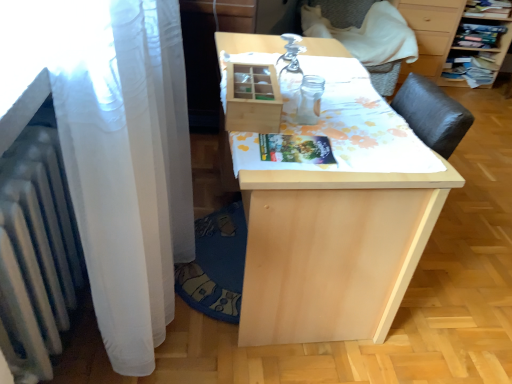
Question: Does point (401, 4) appear closer or farther from the camera than point (369, 238)?

Choices:
 (A) farther
 (B) closer

Answer: (A)

Question: From a real-world perspective, relative to natural wood table at center, is wooden drawer at upper right vertically above or below?

Choices:
 (A) below
 (B) above

Answer: (B)

Question: Estimate the real-world distances between objects in this image. Which object is farther from the natural wood table at center?

Choices:
 (A) gray fabric armchair at upper right
 (B) wooden drawer at upper right
 (C) white metallic radiator at left

Answer: (B)

Question: Estimate the real-world distances between objects in this image. Which object is farther from the natural wood table at center?

Choices:
 (A) gray fabric armchair at upper right
 (B) white metallic radiator at left
 (C) wooden drawer at upper right

Answer: (C)